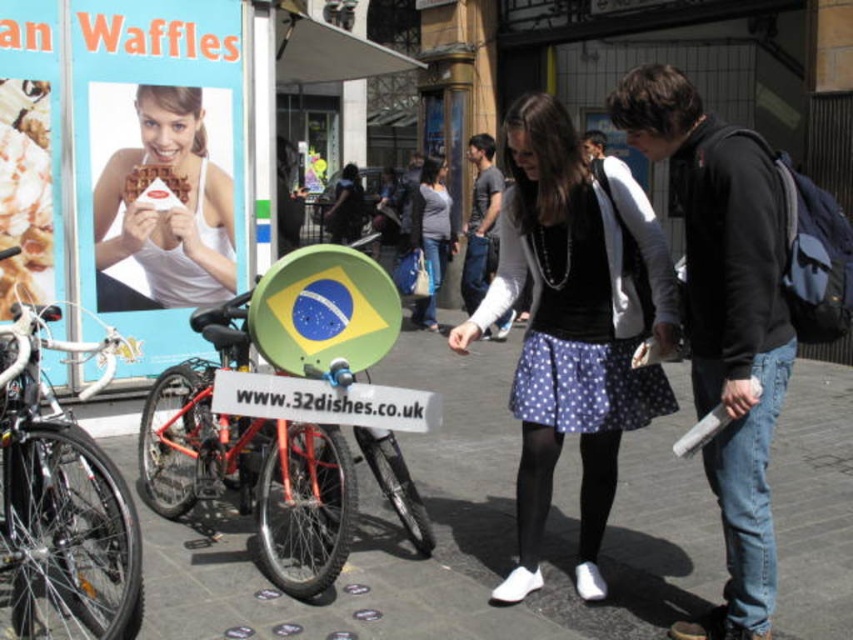
Question: Can you confirm if dark gray t-shirt at center is positioned below matte black skirt at center?

Choices:
 (A) no
 (B) yes

Answer: (B)

Question: Which of the following is the farthest from the observer?

Choices:
 (A) (0, 544)
 (B) (732, 476)

Answer: (A)

Question: Can you confirm if polka dot skirt at center is bigger than jeans at right?

Choices:
 (A) yes
 (B) no

Answer: (A)

Question: Based on their relative distances, which object is nearer to the matte black skirt at center?

Choices:
 (A) jeans at right
 (B) matte gray sweater at center
 (C) dark gray t-shirt at center

Answer: (B)

Question: Which object appears farthest from the camera in this image?

Choices:
 (A) matte white billboard at upper left
 (B) white plastic sign at center

Answer: (A)

Question: Is polka dot skirt at center to the left of dark gray t-shirt at center from the viewer's perspective?

Choices:
 (A) yes
 (B) no

Answer: (B)